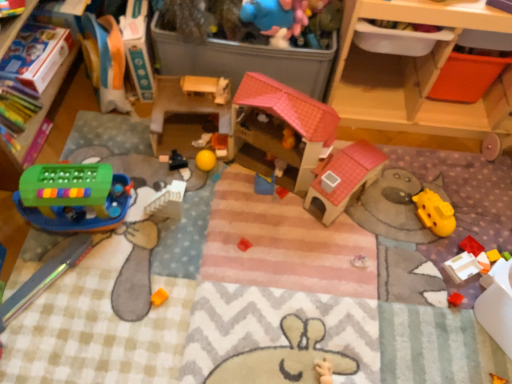
Question: Is yellow rubber ball at center, the fifth toy in the right-to-left sequence, at the left side of white plastic block at lower right, the 2th toy positioned from the right?

Choices:
 (A) no
 (B) yes

Answer: (B)

Question: Considering the relative sizes of yellow rubber ball at center, the fifth toy in the right-to-left sequence, and white plastic block at lower right, acting as the eighth toy starting from the left, in the image provided, is yellow rubber ball at center, the fifth toy in the right-to-left sequence, smaller than white plastic block at lower right, acting as the eighth toy starting from the left,?

Choices:
 (A) yes
 (B) no

Answer: (B)

Question: Is yellow rubber ball at center, the fifth toy in the right-to-left sequence, far from white plastic block at lower right, acting as the eighth toy starting from the left?

Choices:
 (A) yes
 (B) no

Answer: (B)

Question: Is yellow rubber ball at center, which is counted as the fifth toy, starting from the left, aimed at white plastic block at lower right, the 2th toy positioned from the right?

Choices:
 (A) no
 (B) yes

Answer: (A)

Question: Does yellow rubber ball at center, which is counted as the fifth toy, starting from the left, have a larger size compared to white plastic block at lower right, the 2th toy positioned from the right?

Choices:
 (A) yes
 (B) no

Answer: (A)

Question: Can you confirm if yellow rubber ball at center, which is counted as the fifth toy, starting from the left, is positioned to the right of white plastic block at lower right, acting as the eighth toy starting from the left?

Choices:
 (A) no
 (B) yes

Answer: (A)

Question: Does white plastic block at lower right, the 2th toy positioned from the right, appear on the right side of bright red plastic block at lower right, the ninth toy positioned from the left?

Choices:
 (A) yes
 (B) no

Answer: (B)

Question: From a real-world perspective, is white plastic block at lower right, acting as the eighth toy starting from the left, on top of bright red plastic block at lower right, which appears as the first toy when viewed from the right?

Choices:
 (A) no
 (B) yes

Answer: (B)

Question: From the image's perspective, is white plastic block at lower right, acting as the eighth toy starting from the left, on bright red plastic block at lower right, which appears as the first toy when viewed from the right?

Choices:
 (A) yes
 (B) no

Answer: (B)

Question: Is white plastic block at lower right, acting as the eighth toy starting from the left, closer to the viewer compared to bright red plastic block at lower right, which appears as the first toy when viewed from the right?

Choices:
 (A) no
 (B) yes

Answer: (B)

Question: Is white plastic block at lower right, the 2th toy positioned from the right, facing away from bright red plastic block at lower right, which appears as the first toy when viewed from the right?

Choices:
 (A) yes
 (B) no

Answer: (A)

Question: Does white plastic block at lower right, acting as the eighth toy starting from the left, have a lesser height compared to bright red plastic block at lower right, the ninth toy positioned from the left?

Choices:
 (A) yes
 (B) no

Answer: (B)

Question: Does wooden drawer at upper right come in front of yellow rubber ball at center, which is counted as the fifth toy, starting from the left?

Choices:
 (A) yes
 (B) no

Answer: (A)